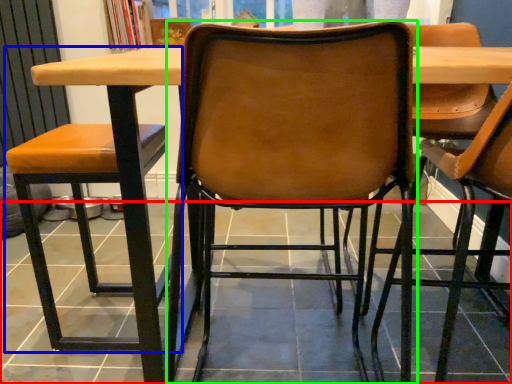
Question: Which object is positioned farthest from tile (highlighted by a red box)? Select from chair (highlighted by a blue box) and chair (highlighted by a green box).

Choices:
 (A) chair
 (B) chair

Answer: (A)